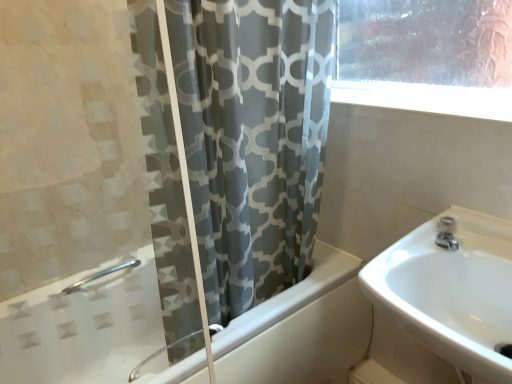
Where is `white glossy sink at right`? white glossy sink at right is located at coordinates (451, 292).

Describe the element at coordinates (451, 292) in the screenshot. The height and width of the screenshot is (384, 512). I see `white glossy sink at right` at that location.

Image resolution: width=512 pixels, height=384 pixels. What do you see at coordinates (253, 138) in the screenshot? I see `gray fabric curtain at center` at bounding box center [253, 138].

At what (x,y) coordinates should I click in order to perform the action: click on gray fabric curtain at center. Please return your answer as a coordinate pair (x, y). The height and width of the screenshot is (384, 512). Looking at the image, I should click on (253, 138).

You are a GUI agent. You are given a task and a screenshot of the screen. Output one action in this format:
    pyautogui.click(x=<x>, y=<y>)
    Task: Click on the satin nickel faucet at upper right
    The image size is (512, 384).
    Given the screenshot: What is the action you would take?
    [x=446, y=233]

What do you see at coordinates (82, 329) in the screenshot? I see `white glossy bathtub at center` at bounding box center [82, 329].

At what (x,y) coordinates should I click in order to perform the action: click on white glossy bathtub at center. Please return your answer as a coordinate pair (x, y). Looking at the image, I should click on (82, 329).

Image resolution: width=512 pixels, height=384 pixels. What are the coordinates of `white glossy sink at right` in the screenshot? It's located at (451, 292).

Is white glossy sink at right to the left of gray fabric curtain at center from the viewer's perspective?

Incorrect, white glossy sink at right is not on the left side of gray fabric curtain at center.

From the image's perspective, is white glossy sink at right over gray fabric curtain at center?

Actually, white glossy sink at right appears below gray fabric curtain at center in the image.

From a real-world perspective, is white glossy sink at right physically above gray fabric curtain at center?

No, from a real-world perspective, white glossy sink at right is not on top of gray fabric curtain at center.

Do you think white glossy sink at right is within gray fabric curtain at center, or outside of it?

white glossy sink at right is located beyond the bounds of gray fabric curtain at center.

Which object is positioned more to the right, gray fabric curtain at center or satin nickel faucet at upper right?

satin nickel faucet at upper right is more to the right.

There is a satin nickel faucet at upper right. Where is `curtain above it (from a real-world perspective)`? The height and width of the screenshot is (384, 512). curtain above it (from a real-world perspective) is located at coordinates (253, 138).

Considering the sizes of objects gray fabric curtain at center and satin nickel faucet at upper right in the image provided, who is thinner, gray fabric curtain at center or satin nickel faucet at upper right?

satin nickel faucet at upper right.

Is there a large distance between white glossy sink at right and satin nickel faucet at upper right?

white glossy sink at right is near satin nickel faucet at upper right, not far away.

Considering the relative positions of white glossy sink at right and satin nickel faucet at upper right in the image provided, is white glossy sink at right to the right of satin nickel faucet at upper right from the viewer's perspective?

Yes.

What's the angular difference between white glossy sink at right and satin nickel faucet at upper right's facing directions?

white glossy sink at right and satin nickel faucet at upper right are facing 41.8 degrees away from each other.

Does white glossy sink at right come behind satin nickel faucet at upper right?

No, white glossy sink at right is in front of satin nickel faucet at upper right.

Can you confirm if satin nickel faucet at upper right is thinner than white glossy bathtub at center?

Yes.

Is satin nickel faucet at upper right not close to white glossy bathtub at center?

satin nickel faucet at upper right is near white glossy bathtub at center, not far away.

Is satin nickel faucet at upper right shorter than white glossy bathtub at center?

Indeed, satin nickel faucet at upper right has a lesser height compared to white glossy bathtub at center.

From the image's perspective, between satin nickel faucet at upper right and white glossy bathtub at center, which one is located above?

satin nickel faucet at upper right, from the image's perspective.

Consider the image. Is satin nickel faucet at upper right inside the boundaries of white glossy sink at right, or outside?

The correct answer is: inside.

From the image's perspective, which object appears higher, satin nickel faucet at upper right or white glossy sink at right?

From the image's view, satin nickel faucet at upper right is above.

Find the location of a particular element. sink that is under the satin nickel faucet at upper right (from a real-world perspective) is located at coordinates (451, 292).

Is satin nickel faucet at upper right not near white glossy sink at right?

No, there isn't a large distance between satin nickel faucet at upper right and white glossy sink at right.

Is white glossy bathtub at center positioned with its back to gray fabric curtain at center?

No, white glossy bathtub at center's orientation is not away from gray fabric curtain at center.

Can you confirm if white glossy bathtub at center is smaller than gray fabric curtain at center?

No, white glossy bathtub at center is not smaller than gray fabric curtain at center.

Considering the points (284, 328) and (179, 65), which point is behind, point (284, 328) or point (179, 65)?

The point (284, 328) is farther.

Based on the photo, does white glossy sink at right lie behind white glossy bathtub at center?

No, it is in front of white glossy bathtub at center.

Is white glossy sink at right bigger than white glossy bathtub at center?

Actually, white glossy sink at right might be smaller than white glossy bathtub at center.

From the image's perspective, which one is positioned lower, white glossy sink at right or white glossy bathtub at center?

From the image's view, white glossy bathtub at center is below.

At what (x,y) coordinates should I click in order to perform the action: click on bathtub behind the white glossy sink at right. Please return your answer as a coordinate pair (x, y). The height and width of the screenshot is (384, 512). Looking at the image, I should click on pyautogui.click(x=82, y=329).

In order to click on sink that appears below the gray fabric curtain at center (from a real-world perspective) in this screenshot , I will do `click(451, 292)`.

Locate an element on the screen. The image size is (512, 384). curtain above the satin nickel faucet at upper right (from a real-world perspective) is located at coordinates [x=253, y=138].

From the image, which object appears to be farther from satin nickel faucet at upper right, white glossy sink at right or white glossy bathtub at center?

The object further to satin nickel faucet at upper right is white glossy bathtub at center.

From the image, which object appears to be farther from gray fabric curtain at center, satin nickel faucet at upper right or white glossy bathtub at center?

satin nickel faucet at upper right is positioned further to the anchor gray fabric curtain at center.

Estimate the real-world distances between objects in this image. Which object is closer to white glossy bathtub at center, gray fabric curtain at center or white glossy sink at right?

gray fabric curtain at center is closer to white glossy bathtub at center.

Which object lies nearer to the anchor point white glossy bathtub at center, white glossy sink at right or gray fabric curtain at center?

gray fabric curtain at center is closer to white glossy bathtub at center.

Looking at the image, which one is located closer to white glossy bathtub at center, white glossy sink at right or satin nickel faucet at upper right?

The object closer to white glossy bathtub at center is white glossy sink at right.

When comparing their distances from gray fabric curtain at center, does white glossy sink at right or satin nickel faucet at upper right seem closer?

white glossy sink at right is closer to gray fabric curtain at center.

Considering their positions, is satin nickel faucet at upper right positioned further to white glossy bathtub at center than gray fabric curtain at center?

Among the two, satin nickel faucet at upper right is located further to white glossy bathtub at center.

When comparing their distances from white glossy bathtub at center, does gray fabric curtain at center or satin nickel faucet at upper right seem further?

satin nickel faucet at upper right lies further to white glossy bathtub at center than the other object.

The image size is (512, 384). I want to click on curtain between white glossy bathtub at center and satin nickel faucet at upper right, so click(x=253, y=138).

The height and width of the screenshot is (384, 512). Find the location of `curtain situated between white glossy bathtub at center and white glossy sink at right from left to right`. curtain situated between white glossy bathtub at center and white glossy sink at right from left to right is located at coordinates (253, 138).

Locate an element on the screen. tap between gray fabric curtain at center and white glossy sink at right in the horizontal direction is located at coordinates (446, 233).

Find the location of a particular element. Image resolution: width=512 pixels, height=384 pixels. tap between white glossy bathtub at center and white glossy sink at right in the horizontal direction is located at coordinates (446, 233).